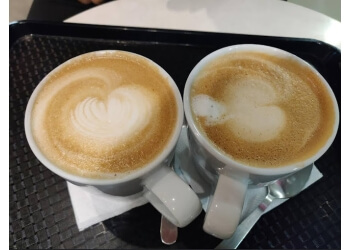
The width and height of the screenshot is (350, 250). Identify the location of napkins. (92, 205), (317, 175).